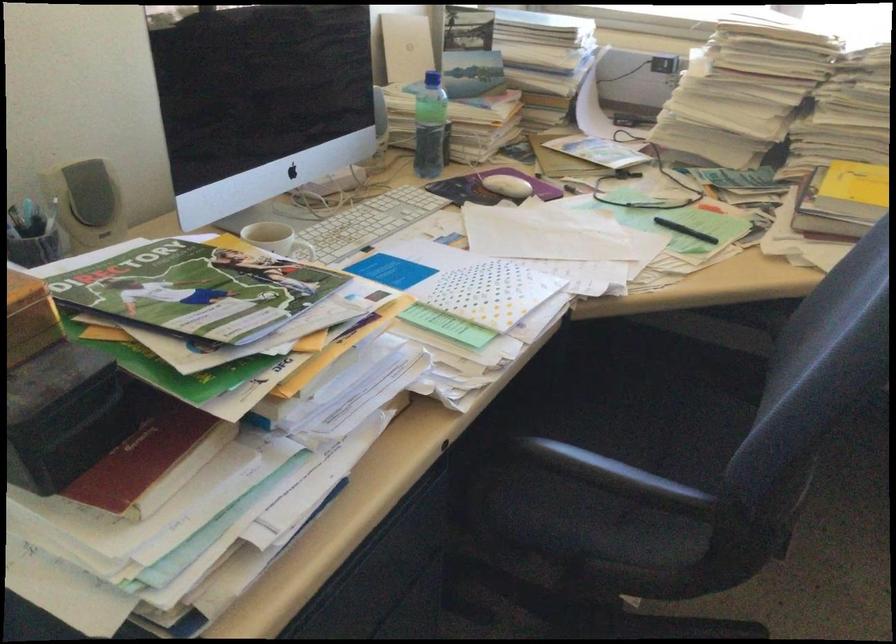
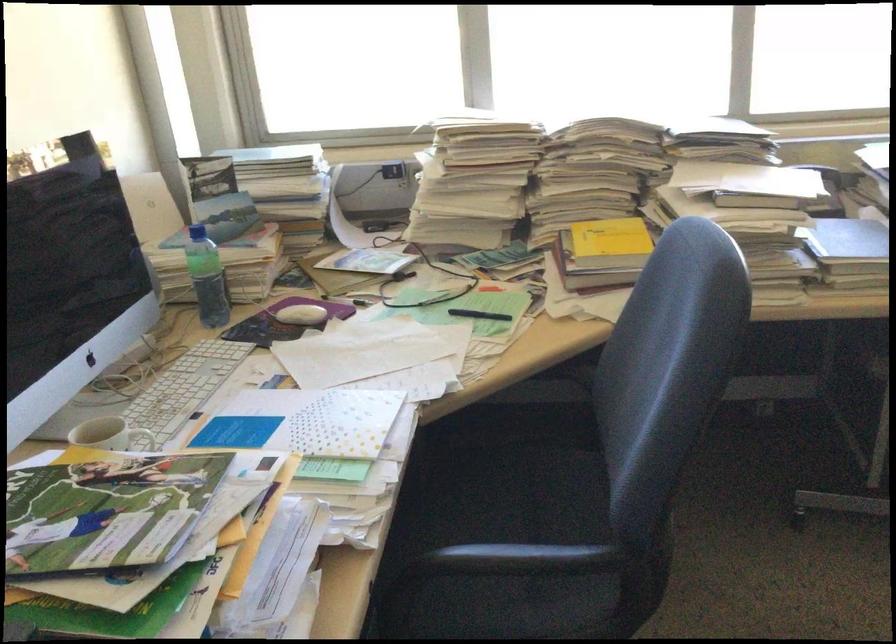
Question: The camera is either moving clockwise (left) or counter-clockwise (right) around the object. The first image is from the beginning of the video and the second image is from the end. Is the camera moving left or right when shooting the video?

Choices:
 (A) Left
 (B) Right

Answer: (A)